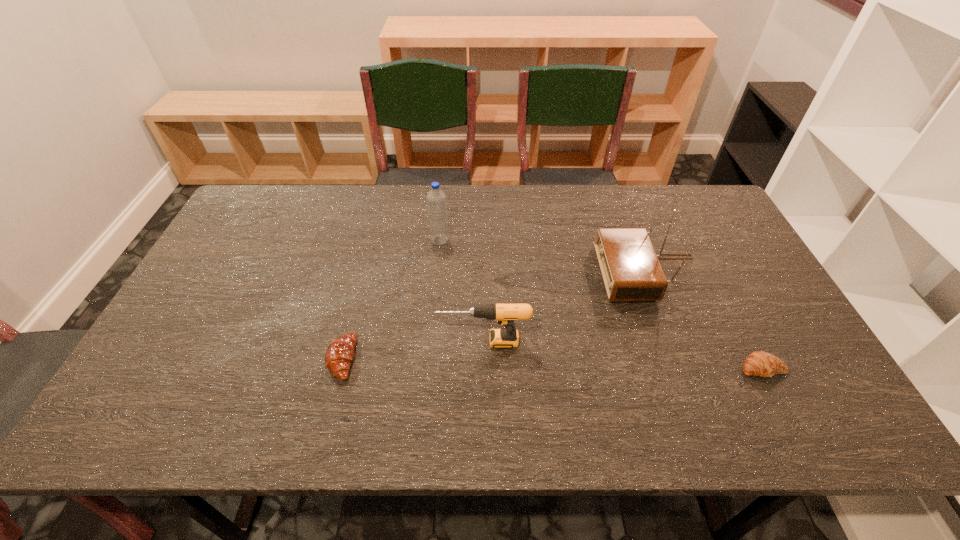
At what (x,y) coordinates should I click in order to perform the action: click on object that is the fourth closest to the radio_receiver. Please return your answer as a coordinate pair (x, y). The width and height of the screenshot is (960, 540). Looking at the image, I should click on (339, 354).

Where is `blank space that satisfies the following two spatial constraints: 1. on the handle side of the third shortest object; 2. on the left side of the right crescent roll`? Image resolution: width=960 pixels, height=540 pixels. blank space that satisfies the following two spatial constraints: 1. on the handle side of the third shortest object; 2. on the left side of the right crescent roll is located at coordinates (484, 368).

Where is `vacant area that satisfies the following two spatial constraints: 1. on the front panel of the radio_receiver; 2. on the back side of the right crescent roll`? The height and width of the screenshot is (540, 960). vacant area that satisfies the following two spatial constraints: 1. on the front panel of the radio_receiver; 2. on the back side of the right crescent roll is located at coordinates (685, 368).

Locate an element on the screen. The width and height of the screenshot is (960, 540). free spot that satisfies the following two spatial constraints: 1. on the front panel of the radio_receiver; 2. on the right side of the right crescent roll is located at coordinates coord(685,368).

This screenshot has width=960, height=540. Find the location of `free space that satisfies the following two spatial constraints: 1. on the handle side of the right crescent roll; 2. on the right side of the third shortest object`. free space that satisfies the following two spatial constraints: 1. on the handle side of the right crescent roll; 2. on the right side of the third shortest object is located at coordinates click(484, 368).

The height and width of the screenshot is (540, 960). I want to click on free location that satisfies the following two spatial constraints: 1. on the handle side of the third tallest object; 2. on the left side of the right crescent roll, so click(484, 368).

Find the location of a particular element. vacant space that satisfies the following two spatial constraints: 1. on the handle side of the third tallest object; 2. on the left side of the right crescent roll is located at coordinates (484, 368).

At what (x,y) coordinates should I click in order to perform the action: click on vacant region that satisfies the following two spatial constraints: 1. on the handle side of the third tallest object; 2. on the right side of the right crescent roll. Please return your answer as a coordinate pair (x, y). The image size is (960, 540). Looking at the image, I should click on (484, 368).